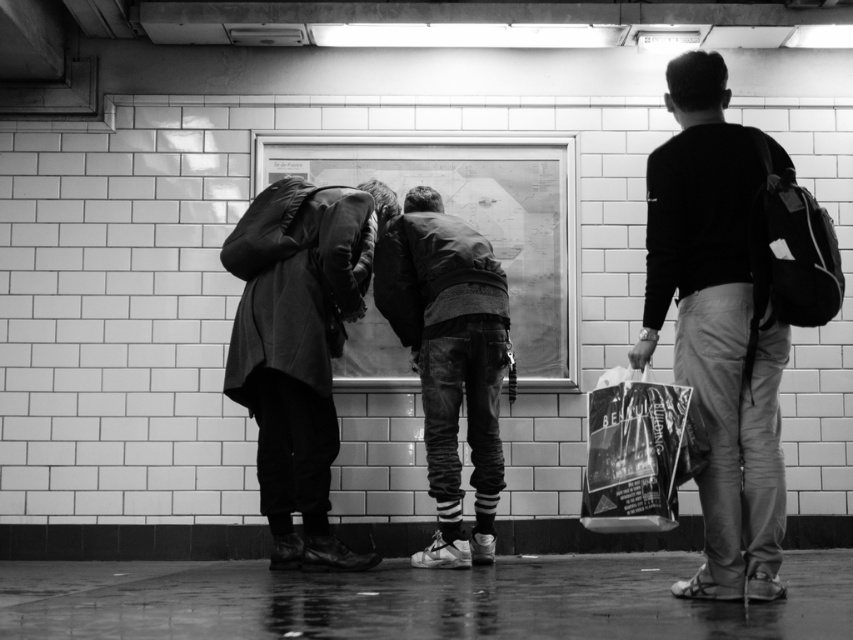
You are a delivery person holding a package that is 6 feet long. You need to place it between the denim jeans at center and the shiny plastic bag at right. Is there enough space to fit the package without bending it?

The denim jeans at center is 5.87 feet from the shiny plastic bag at right. Since the package is 6 feet long, it will not fit between them without bending it because the distance is slightly shorter than the package.

You are a person standing in the subway station and you want to place both the cozy woolen coat at center and the shiny plastic bag at right on the floor. Which object will occupy more floor space when placed?

The cozy woolen coat at center has a larger size compared to the shiny plastic bag at right, so it will occupy more floor space when placed on the floor.